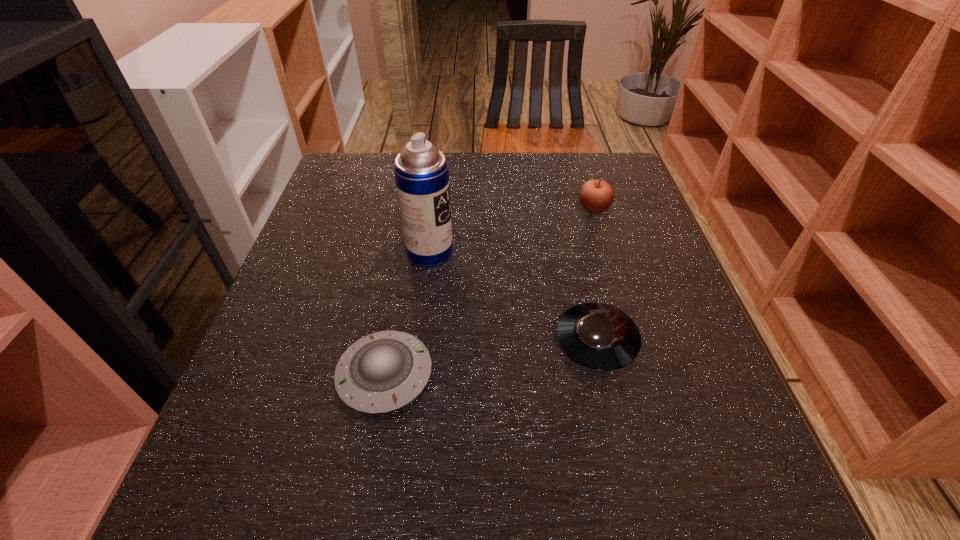
Where is `free spot located on the right of the shortest object`? The height and width of the screenshot is (540, 960). free spot located on the right of the shortest object is located at coordinates (542, 375).

Where is `object present at the far edge`? Image resolution: width=960 pixels, height=540 pixels. object present at the far edge is located at coordinates (596, 196).

Where is `apple present at the right edge`? The height and width of the screenshot is (540, 960). apple present at the right edge is located at coordinates (596, 196).

Find the location of a particular element. The width and height of the screenshot is (960, 540). saucer that is positioned at the right edge is located at coordinates (598, 336).

The width and height of the screenshot is (960, 540). I want to click on object situated at the far right corner, so click(596, 196).

Locate an element on the screen. free space at the far edge of the desktop is located at coordinates (469, 186).

In the image, there is a desktop. At what (x,y) coordinates should I click in order to perform the action: click on free region at the left edge. Please return your answer as a coordinate pair (x, y). Looking at the image, I should click on (287, 430).

What are the coordinates of `vacant space at the right edge of the desktop` in the screenshot? It's located at (658, 321).

In the image, there is a desktop. At what (x,y) coordinates should I click in order to perform the action: click on vacant space at the far left corner. Please return your answer as a coordinate pair (x, y). The image size is (960, 540). Looking at the image, I should click on (394, 158).

Where is `free space at the near left corner`? free space at the near left corner is located at coordinates (287, 516).